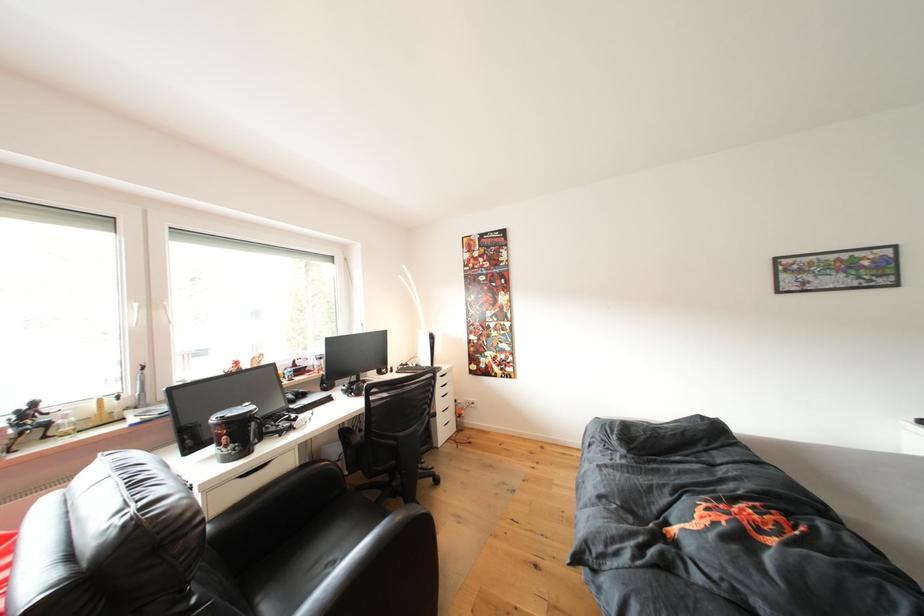
Image resolution: width=924 pixels, height=616 pixels. Find the location of `white window handle`. white window handle is located at coordinates (136, 313).